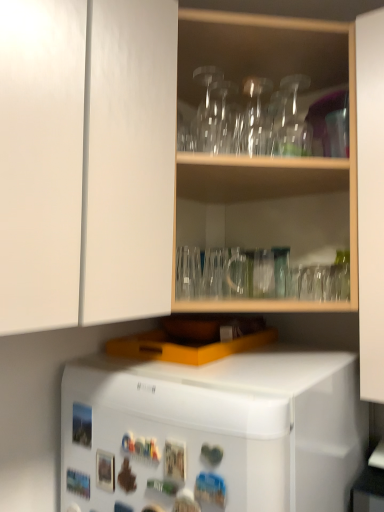
What do you see at coordinates (294, 120) in the screenshot? The width and height of the screenshot is (384, 512). I see `transparent glass vase at upper center, which ranks as the 1th glass vase in front-to-back order` at bounding box center [294, 120].

What is the approximate height of white matte cabinet doors at upper left?

white matte cabinet doors at upper left is 28.08 inches tall.

At what (x,y) coordinates should I click in order to perform the action: click on transparent glass vase at upper center, arranged as the second glass vase when viewed from the back. Please return your answer as a coordinate pair (x, y). Looking at the image, I should click on (294, 120).

In the scene shown: Is white matte refrigerator at lower center not close to transparent glass vase at upper center, which ranks as the first glass vase in back-to-front order?

No, white matte refrigerator at lower center is in close proximity to transparent glass vase at upper center, which ranks as the first glass vase in back-to-front order.

Is transparent glass vase at upper center, which appears as the 1th glass vase when viewed from the left, at the back of white matte refrigerator at lower center?

That's not correct — white matte refrigerator at lower center is not looking away from transparent glass vase at upper center, which appears as the 1th glass vase when viewed from the left.

Does point (346, 488) lie behind point (253, 121)?

No.

Considering the relative sizes of white matte refrigerator at lower center and transparent glass vase at upper center, which is the 2th glass vase from right to left, in the image provided, is white matte refrigerator at lower center wider than transparent glass vase at upper center, which is the 2th glass vase from right to left,?

Indeed, white matte refrigerator at lower center has a greater width compared to transparent glass vase at upper center, which is the 2th glass vase from right to left.

How far apart are transparent glassware at upper center and white matte cabinet doors at upper left?

They are 31.86 centimeters apart.

Is white matte cabinet doors at upper left completely or partially inside transparent glassware at upper center?

Definitely not — white matte cabinet doors at upper left is not inside transparent glassware at upper center.

From their relative heights in the image, would you say transparent glassware at upper center is taller or shorter than white matte cabinet doors at upper left?

Considering their sizes, transparent glassware at upper center has more height than white matte cabinet doors at upper left.

Considering the relative positions of transparent glassware at upper center and white matte cabinet doors at upper left in the image provided, is transparent glassware at upper center to the left of white matte cabinet doors at upper left from the viewer's perspective?

Incorrect, transparent glassware at upper center is not on the left side of white matte cabinet doors at upper left.

Looking at this image, is transparent glass vase at upper center, which ranks as the first glass vase in back-to-front order, at the back of transparent glassware at upper center?

Correct, transparent glassware at upper center is looking away from transparent glass vase at upper center, which ranks as the first glass vase in back-to-front order.

Can you confirm if transparent glassware at upper center is wider than transparent glass vase at upper center, which appears as the 1th glass vase when viewed from the left?

Correct, the width of transparent glassware at upper center exceeds that of transparent glass vase at upper center, which appears as the 1th glass vase when viewed from the left.

From the image's perspective, between transparent glassware at upper center and transparent glass vase at upper center, the second glass vase positioned from the front, who is located below?

transparent glassware at upper center appears lower in the image.

In the scene shown: Considering the relative sizes of transparent glassware at upper center and transparent glass vase at upper center, the second glass vase positioned from the front, in the image provided, is transparent glassware at upper center shorter than transparent glass vase at upper center, the second glass vase positioned from the front,?

Answer: No.

Consider the image. Which of these two, white matte cabinet doors at upper left or white matte refrigerator at lower center, is bigger?

Bigger between the two is white matte refrigerator at lower center.

Is white matte refrigerator at lower center at the back of white matte cabinet doors at upper left?

white matte cabinet doors at upper left does not have its back to white matte refrigerator at lower center.

From the picture: From a real-world perspective, which is physically below, white matte cabinet doors at upper left or white matte refrigerator at lower center?

white matte refrigerator at lower center, from a real-world perspective.

From the image's perspective, relative to transparent glassware at upper center, is white matte cabinet doors at upper left above or below?

Clearly, from the image's perspective, white matte cabinet doors at upper left is above transparent glassware at upper center.

From the picture: How different are the orientations of white matte cabinet doors at upper left and transparent glassware at upper center in degrees?

There is a 44-degree angle between the facing directions of white matte cabinet doors at upper left and transparent glassware at upper center.

Is point (126, 155) closer or farther from the camera than point (199, 52)?

Point (126, 155).

Considering the sizes of transparent glass vase at upper center, arranged as the second glass vase when viewed from the back, and white matte refrigerator at lower center in the image, is transparent glass vase at upper center, arranged as the second glass vase when viewed from the back, wider or thinner than white matte refrigerator at lower center?

transparent glass vase at upper center, arranged as the second glass vase when viewed from the back, is thinner than white matte refrigerator at lower center.

Can you tell me how much transparent glass vase at upper center, arranged as the second glass vase when viewed from the back, and white matte refrigerator at lower center differ in facing direction?

transparent glass vase at upper center, arranged as the second glass vase when viewed from the back, and white matte refrigerator at lower center are facing 44.8 degrees away from each other.

Between transparent glass vase at upper center, positioned as the second glass vase in left-to-right order, and white matte refrigerator at lower center, which one appears on the left side from the viewer's perspective?

white matte refrigerator at lower center.

From a real-world perspective, is transparent glass vase at upper center, the second glass vase positioned from the front, over transparent glassware at upper center?

Yes, from a real-world perspective, transparent glass vase at upper center, the second glass vase positioned from the front, is over transparent glassware at upper center

Locate an element on the screen. The image size is (384, 512). the 2nd glass vase behind the transparent glassware at upper center is located at coordinates (256, 119).

Does transparent glass vase at upper center, which ranks as the first glass vase in back-to-front order, appear on the left side of transparent glassware at upper center?

Indeed, transparent glass vase at upper center, which ranks as the first glass vase in back-to-front order, is positioned on the left side of transparent glassware at upper center.

Is transparent glassware at upper center at the back of transparent glass vase at upper center, which ranks as the first glass vase in back-to-front order?

Correct, transparent glass vase at upper center, which ranks as the first glass vase in back-to-front order, is looking away from transparent glassware at upper center.

From a real-world perspective, starting from the white matte refrigerator at lower center, which glass vase is the 2nd one vertically above it? Please provide its 2D coordinates.

[(256, 119)]

Locate an element on the screen. The width and height of the screenshot is (384, 512). cabinetry below the transparent glassware at upper center (from a real-world perspective) is located at coordinates (86, 161).

Estimate the real-world distances between objects in this image. Which object is closer to transparent glassware at upper center, white matte refrigerator at lower center or transparent glass vase at upper center, which appears as the 1th glass vase when viewed from the left?

transparent glass vase at upper center, which appears as the 1th glass vase when viewed from the left, is positioned closer to the anchor transparent glassware at upper center.

Looking at the image, which one is located further to white matte cabinet doors at upper left, transparent glass vase at upper center, which is the 2th glass vase from right to left, or transparent glass vase at upper center, arranged as the second glass vase when viewed from the back?

Among the two, transparent glass vase at upper center, arranged as the second glass vase when viewed from the back, is located further to white matte cabinet doors at upper left.

Considering their positions, is white matte cabinet doors at upper left positioned further to transparent glass vase at upper center, marked as the 1th glass vase in a right-to-left arrangement, than transparent glass vase at upper center, which appears as the 1th glass vase when viewed from the left?

Based on the image, white matte cabinet doors at upper left appears to be further to transparent glass vase at upper center, marked as the 1th glass vase in a right-to-left arrangement.

Based on their spatial positions, is transparent glassware at upper center or white matte refrigerator at lower center further from transparent glass vase at upper center, the second glass vase positioned from the front?

Among the two, white matte refrigerator at lower center is located further to transparent glass vase at upper center, the second glass vase positioned from the front.

Looking at the image, which one is located further to transparent glass vase at upper center, which ranks as the first glass vase in back-to-front order, white matte cabinet doors at upper left or transparent glass vase at upper center, marked as the 1th glass vase in a right-to-left arrangement?

Among the two, white matte cabinet doors at upper left is located further to transparent glass vase at upper center, which ranks as the first glass vase in back-to-front order.

Looking at the image, which one is located further to transparent glass vase at upper center, marked as the 1th glass vase in a right-to-left arrangement, white matte refrigerator at lower center or transparent glassware at upper center?

The object further to transparent glass vase at upper center, marked as the 1th glass vase in a right-to-left arrangement, is white matte refrigerator at lower center.

When comparing their distances from transparent glassware at upper center, does white matte refrigerator at lower center or transparent glass vase at upper center, positioned as the second glass vase in left-to-right order, seem closer?

The object closer to transparent glassware at upper center is transparent glass vase at upper center, positioned as the second glass vase in left-to-right order.

Considering their positions, is white matte cabinet doors at upper left positioned further to transparent glassware at upper center than white matte refrigerator at lower center?

white matte refrigerator at lower center is further to transparent glassware at upper center.

You are a GUI agent. You are given a task and a screenshot of the screen. Output one action in this format:
    pyautogui.click(x=<x>, y=<y>)
    Task: Click on the shelf between white matte cabinet doors at upper left and white matte refrigerator at lower center in the vertical direction
    
    Given the screenshot: What is the action you would take?
    pyautogui.click(x=264, y=158)

This screenshot has height=512, width=384. In order to click on glass vase that lies between transparent glass vase at upper center, which is the 2th glass vase from right to left, and white matte refrigerator at lower center from top to bottom in this screenshot , I will do `click(294, 120)`.

Where is `glass vase between transparent glassware at upper center and transparent glass vase at upper center, which ranks as the first glass vase in back-to-front order, from front to back`? glass vase between transparent glassware at upper center and transparent glass vase at upper center, which ranks as the first glass vase in back-to-front order, from front to back is located at coordinates (294, 120).

At what (x,y) coordinates should I click in order to perform the action: click on shelf between transparent glass vase at upper center, which is the 2th glass vase from right to left, and white matte refrigerator at lower center, in the vertical direction. Please return your answer as a coordinate pair (x, y). Image resolution: width=384 pixels, height=512 pixels. Looking at the image, I should click on (264, 158).